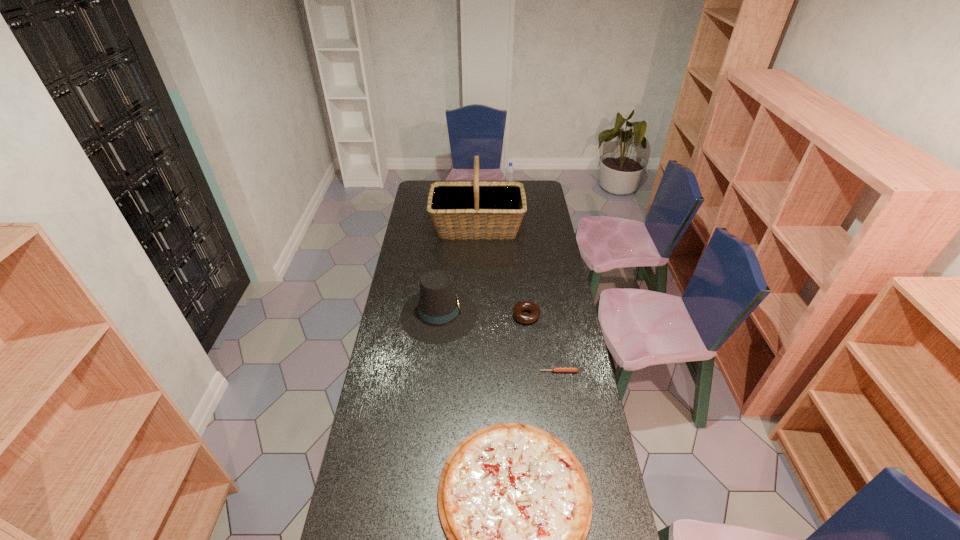
In order to click on free space located 0.100m on the front of the doughnut in this screenshot , I will do `click(529, 344)`.

The width and height of the screenshot is (960, 540). What are the coordinates of `vacant space located 0.050m on the left of the sausage` in the screenshot? It's located at (526, 372).

Where is `object situated at the far edge`? Image resolution: width=960 pixels, height=540 pixels. object situated at the far edge is located at coordinates (510, 171).

What are the coordinates of `basket that is at the left edge` in the screenshot? It's located at (476, 209).

Image resolution: width=960 pixels, height=540 pixels. Identify the location of hat situated at the left edge. (438, 314).

Locate an element on the screen. The width and height of the screenshot is (960, 540). doughnut that is at the right edge is located at coordinates (534, 310).

Locate an element on the screen. This screenshot has width=960, height=540. sausage that is at the right edge is located at coordinates (554, 369).

Where is `vacant space at the left edge of the desktop`? This screenshot has width=960, height=540. vacant space at the left edge of the desktop is located at coordinates (394, 368).

Locate an element on the screen. Image resolution: width=960 pixels, height=540 pixels. vacant space at the right edge of the desktop is located at coordinates 527,231.

What are the coordinates of `vacant region at the far left corner` in the screenshot? It's located at (425, 189).